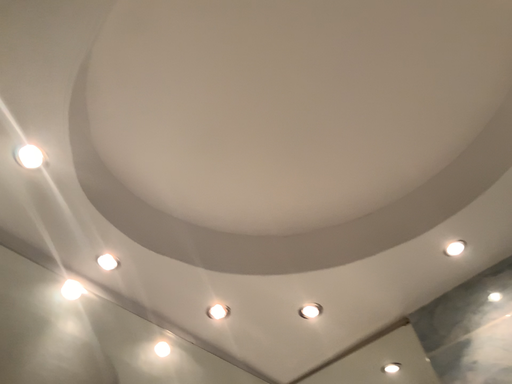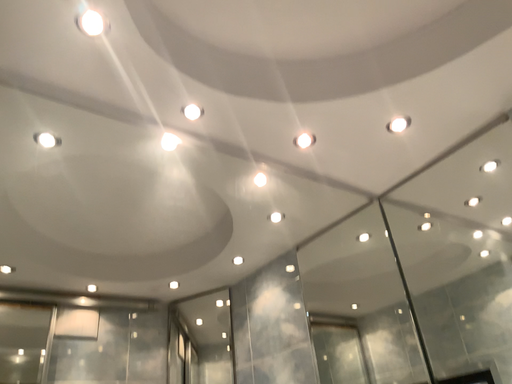
Question: How did the camera likely rotate when shooting the video?

Choices:
 (A) rotated upward
 (B) rotated downward

Answer: (B)